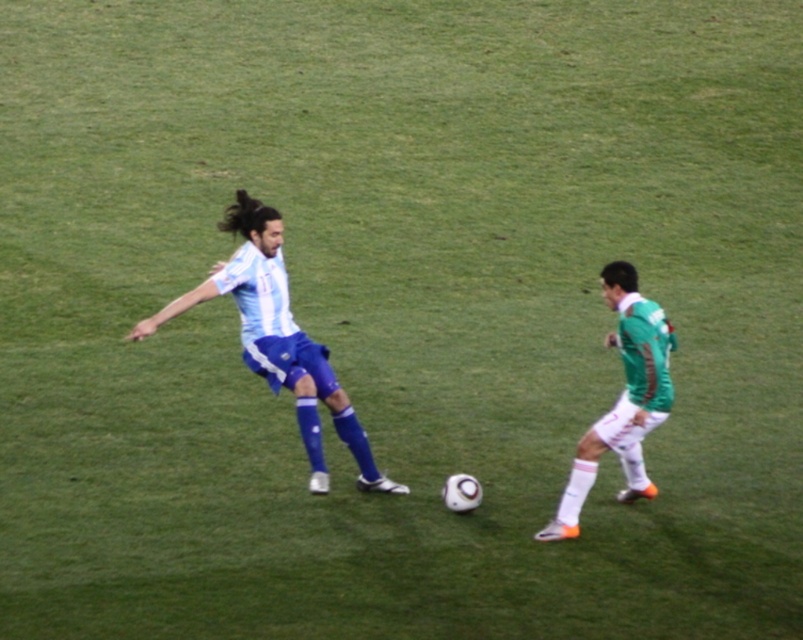
You are a soccer coach analyzing the game footage. You notice the white matte soccer ball at center and the green matte jersey at right. Which object appears larger in the image?

The white matte soccer ball at center appears larger than the green matte jersey at right in the image.

You are a soccer referee positioned at the center circle. You see a white matte jersey at center represented by point (278,339). Is the player wearing the white matte jersey at center closer to you than the edge of the field?

The white matte jersey at center is represented by point (278,339), which is located at the center of the field. Since the center is equidistant from all edges, the player is not closer to the referee than the edge of the field.